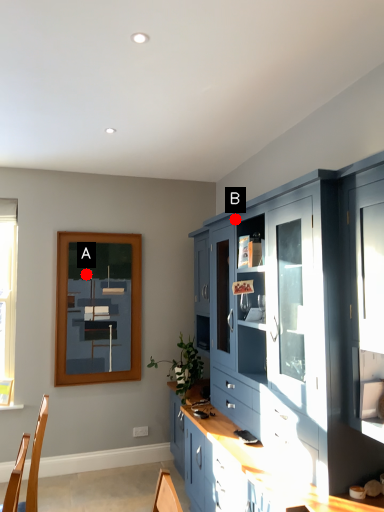
Question: Two points are circled on the image, labeled by A and B beside each circle. Which point is further to the camera?

Choices:
 (A) A is further
 (B) B is further

Answer: (A)